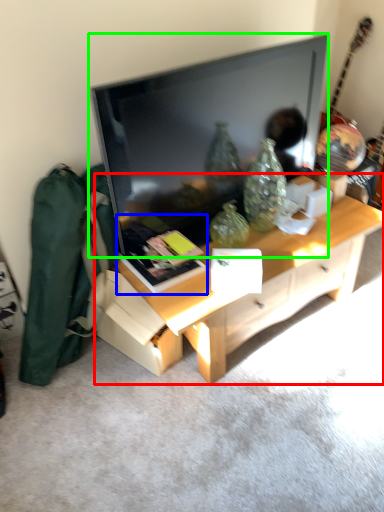
Question: Considering the real-world distances, which object is farthest from desk (highlighted by a red box)? book (highlighted by a blue box) or television (highlighted by a green box)?

Choices:
 (A) book
 (B) television

Answer: (B)